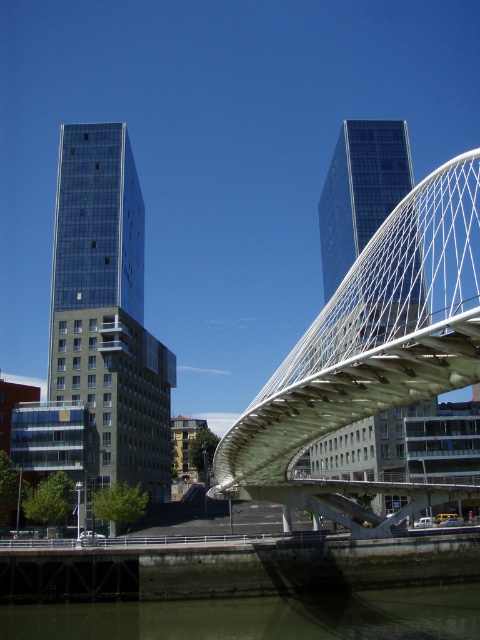
You are standing at the base of the glass buildings and looking towards the pedestrian bridge. There are two points marked on the bridge structure. Which point, point (403, 301) or point (61, 316), is closer to you?

Point (403, 301) is further to the viewer than point (61, 316), so point (61, 316) is closer to you.

You are a drone operator planning to fly a drone from your current position to take aerial shots of the glassy blue building at center. The drone has a maximum flight range of 100 meters. Can the drone reach the building without exceeding its range?

The glassy blue building at center is 98.23 meters away from the viewer. Since the drone can fly up to 100 meters, it can safely reach the building without exceeding its maximum range.